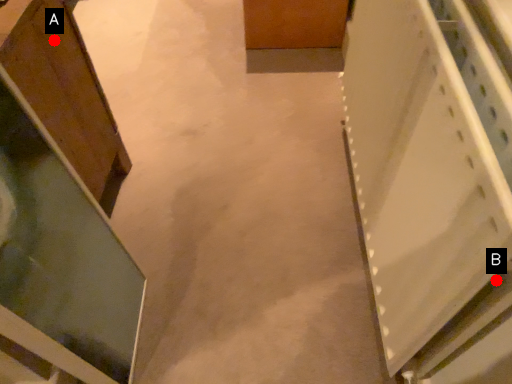
Question: Two points are circled on the image, labeled by A and B beside each circle. Among these points, which one is farthest from the camera?

Choices:
 (A) A is further
 (B) B is further

Answer: (A)